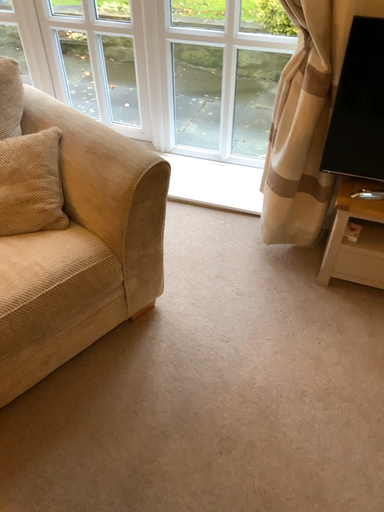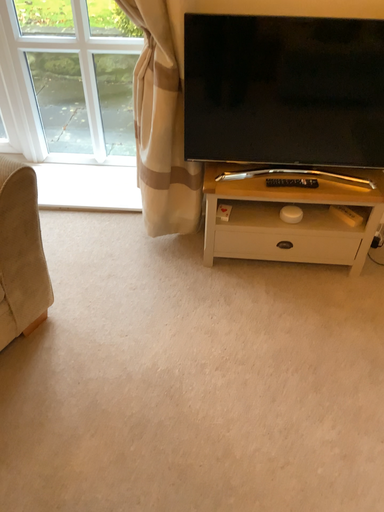
Question: Which way did the camera rotate in the video?

Choices:
 (A) rotated right
 (B) rotated left

Answer: (A)